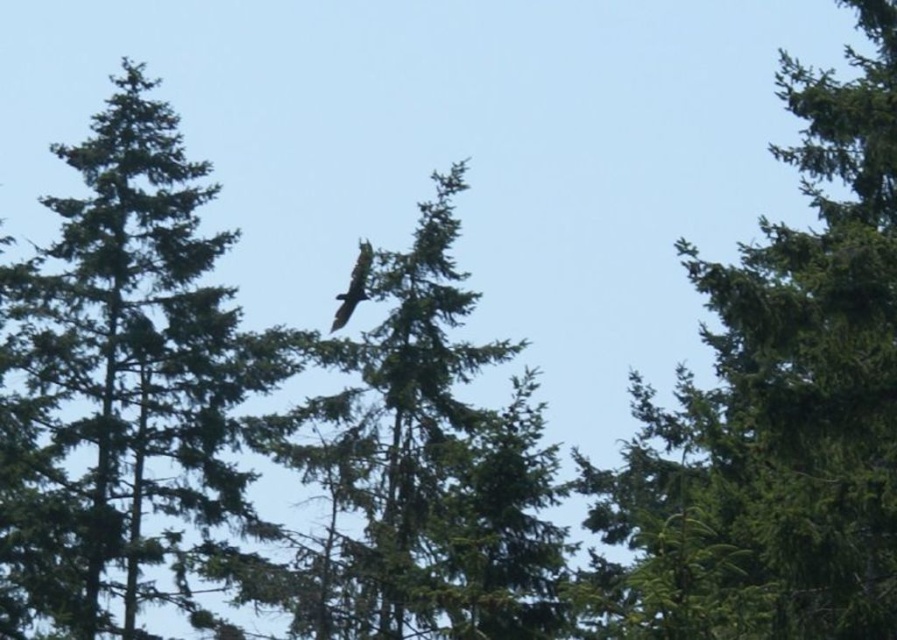
A hiker wants to place a 5 meter long rope between the green textured tree at center and the dark brown feathers at center. Is this possible?

The green textured tree at center and dark brown feathers at center are 5.49 meters apart, so a 5 meter long rope can be placed between them as it is shorter than the distance between the two objects.

You are an ornithologist observing a bird in flight. You see the green textured tree at center and the dark brown feathers at center. Which object is closer to you?

The green textured tree at center is closer to you than the dark brown feathers at center.